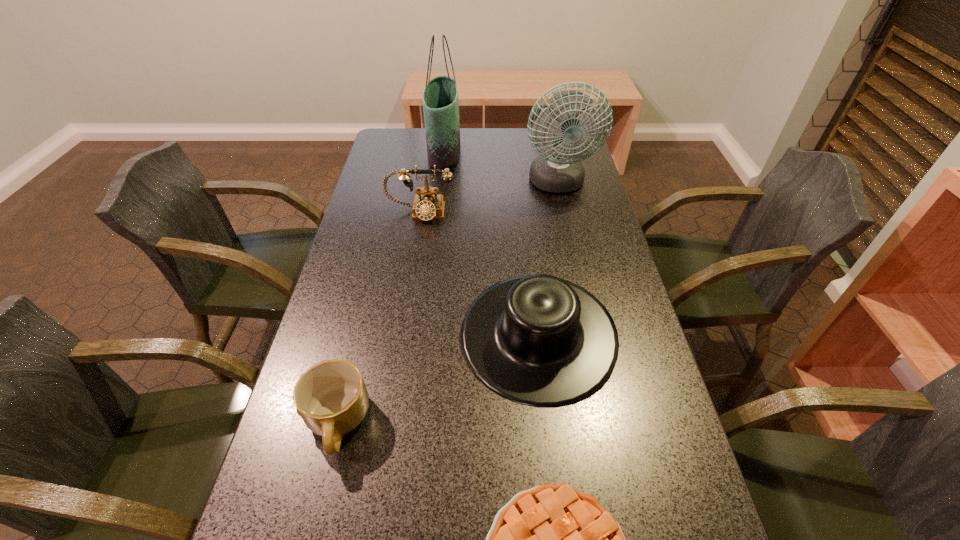
Find the location of a particular element. free space that is in between the dress hat and the tote bag is located at coordinates (492, 244).

Find the location of a particular element. The height and width of the screenshot is (540, 960). empty location between the mug and the tote bag is located at coordinates (391, 287).

What are the coordinates of `free space that is in between the mug and the dress hat` in the screenshot? It's located at (438, 380).

This screenshot has height=540, width=960. Identify the location of vacant region between the dress hat and the telephone. (479, 275).

Image resolution: width=960 pixels, height=540 pixels. In order to click on the fifth closest object to the shortest object in this screenshot , I will do `click(440, 97)`.

This screenshot has height=540, width=960. What are the coordinates of `object that stands as the third closest to the fan` in the screenshot? It's located at (539, 340).

Identify the location of vacant space that satisfies the following two spatial constraints: 1. on the dial number of the telephone; 2. on the right side of the dress hat. This screenshot has width=960, height=540. (400, 337).